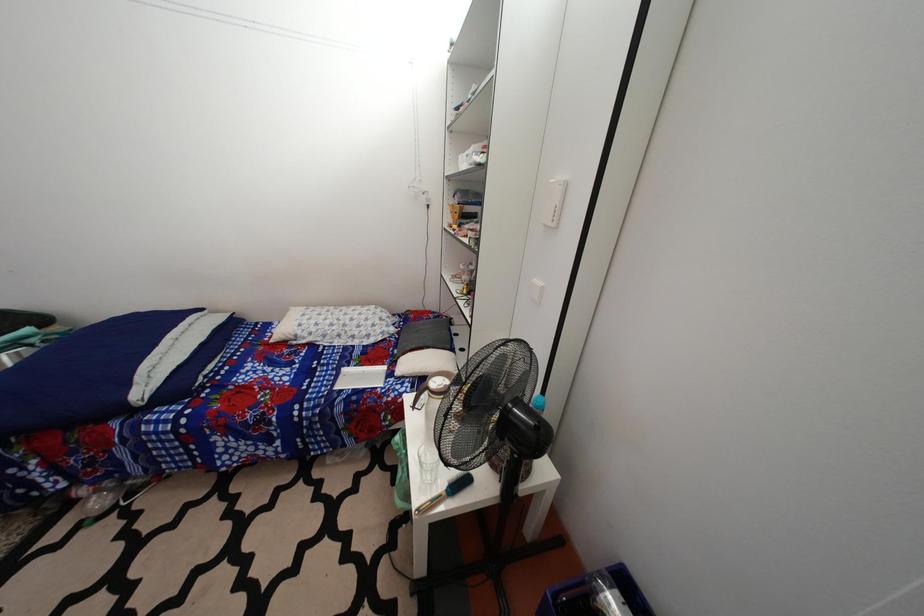
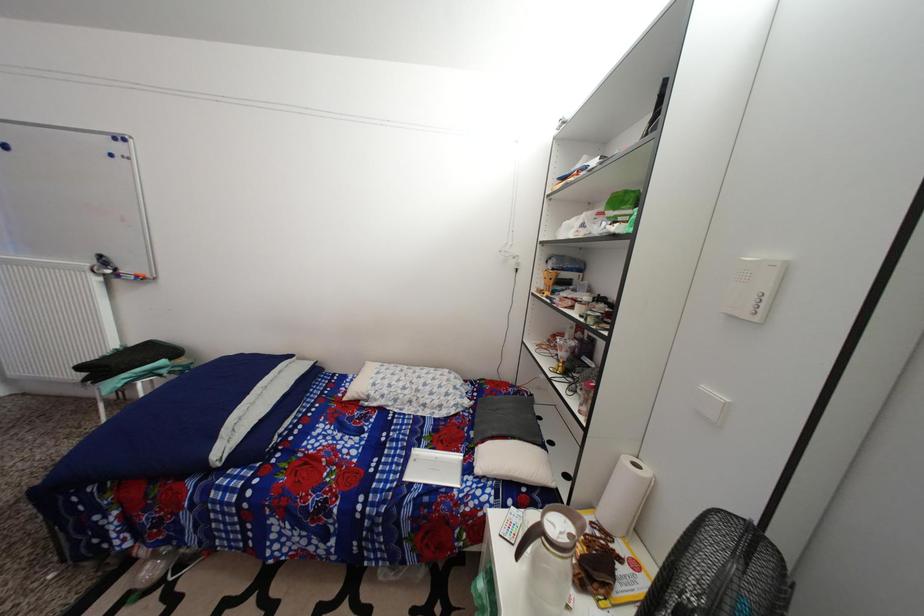
Question: The camera is either moving clockwise (left) or counter-clockwise (right) around the object. The first image is from the beginning of the video and the second image is from the end. Is the camera moving left or right when shooting the video?

Choices:
 (A) Left
 (B) Right

Answer: (B)